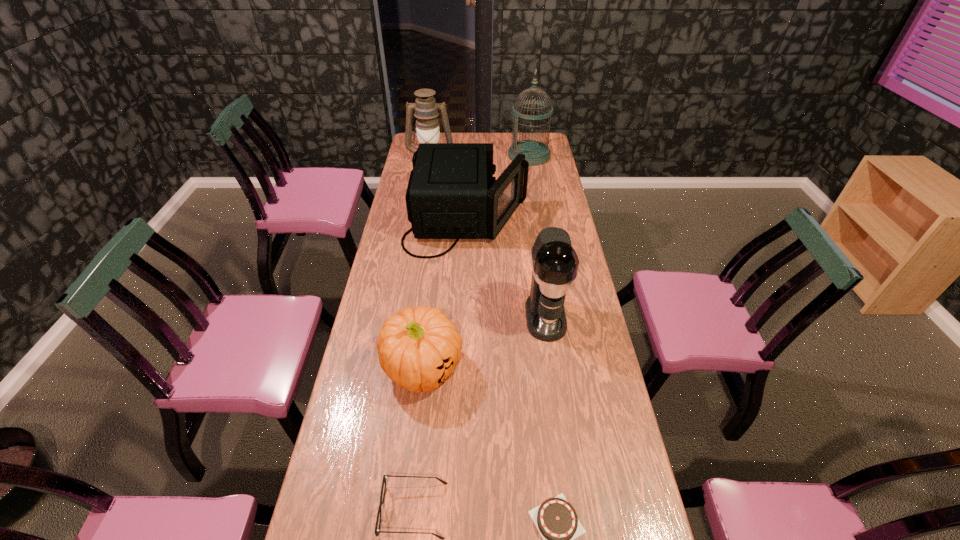
I want to click on birdcage, so click(x=536, y=153).

Identify the location of oil lamp. The width and height of the screenshot is (960, 540). (426, 109).

You are a GUI agent. You are given a task and a screenshot of the screen. Output one action in this format:
    pyautogui.click(x=<x>, y=<y>)
    Task: Click on the coffee maker
    This screenshot has width=960, height=540.
    Given the screenshot: What is the action you would take?
    pyautogui.click(x=555, y=263)

Where is `microwave oven`? Image resolution: width=960 pixels, height=540 pixels. microwave oven is located at coordinates (451, 194).

At what (x,y) coordinates should I click in order to perform the action: click on pumpkin. Please return your answer as a coordinate pair (x, y). This screenshot has width=960, height=540. Looking at the image, I should click on (418, 348).

You are a GUI agent. You are given a task and a screenshot of the screen. Output one action in this format:
    pyautogui.click(x=<x>, y=<y>)
    Task: Click on the free region located 0.050m on the front-facing side of the birdcage
    The height and width of the screenshot is (540, 960).
    Given the screenshot: What is the action you would take?
    pyautogui.click(x=499, y=156)

The image size is (960, 540). In order to click on free point located 0.270m on the front-facing side of the birdcage in this screenshot , I will do `click(458, 156)`.

Image resolution: width=960 pixels, height=540 pixels. Find the location of `vacant area situated 0.090m on the front-facing side of the birdcage`. vacant area situated 0.090m on the front-facing side of the birdcage is located at coordinates 492,156.

Locate an element on the screen. free space located 0.250m on the front of the oil lamp is located at coordinates [425, 196].

The width and height of the screenshot is (960, 540). What are the coordinates of `vacant region located 0.110m place cup under the spout of the coffee maker` in the screenshot? It's located at (553, 370).